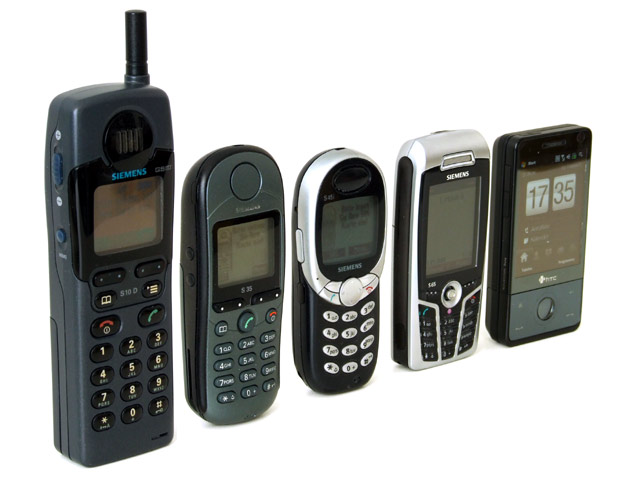
Locate an element on the screen. screen is located at coordinates (130, 208), (228, 252), (349, 233), (443, 231), (540, 228).